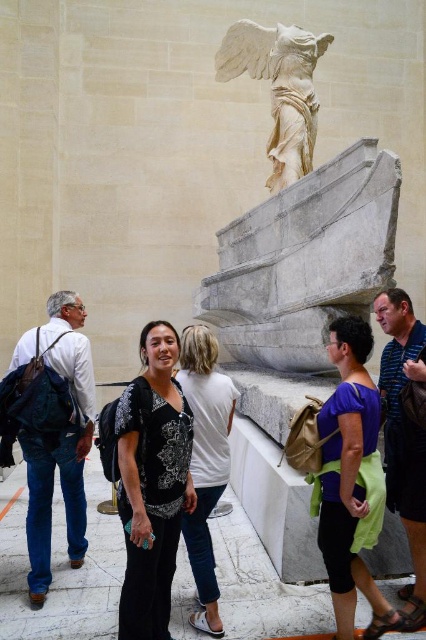
You are standing in the museum and want to take a photo of the Winged Victory of Samothrace. There are two people in front of you wearing striped cotton shirt at center and white cotton shirt at center. Which person should you ask to move so you can get a clear shot?

You should ask the striped cotton shirt at center to move because they are closer to the viewer than the white cotton shirt at center, blocking your view more directly.

You are a tour guide standing in front of the Winged Victory of Samothrace sculpture. You notice two visitors wearing a purple fabric at center and a striped cotton shirt at center. If you want to ensure both visitors can hear your explanation clearly, how far apart are they from each other?

The purple fabric at center and striped cotton shirt at center are 3.24 meters apart from each other.

You are a tour guide standing in front of the Winged Victory of Samothrace sculpture. You notice two visitors wearing a purple fabric at center and a white cotton shirt at center. Which visitor is standing to the right of the other?

The purple fabric at center is positioned on the right side of white cotton shirt at center, so the visitor wearing the purple fabric at center is standing to the right of the visitor wearing the white cotton shirt at center.